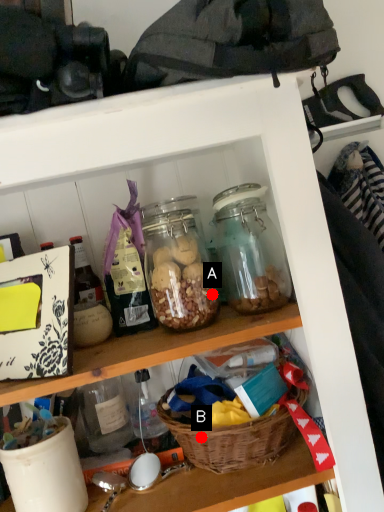
Question: Two points are circled on the image, labeled by A and B beside each circle. Which point is closer to the camera?

Choices:
 (A) A is closer
 (B) B is closer

Answer: (B)